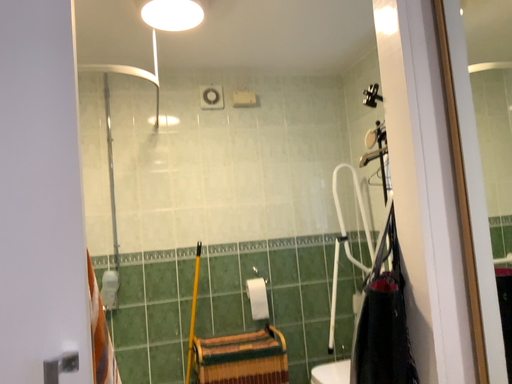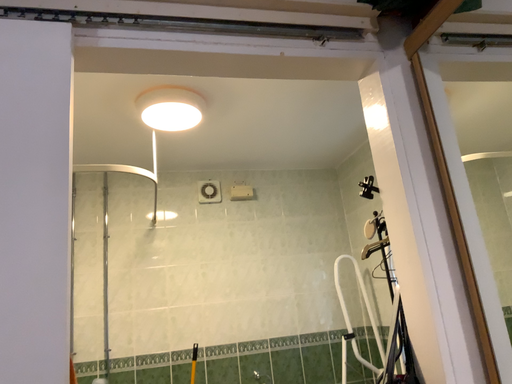
Question: How did the camera likely rotate when shooting the video?

Choices:
 (A) rotated upward
 (B) rotated downward

Answer: (A)